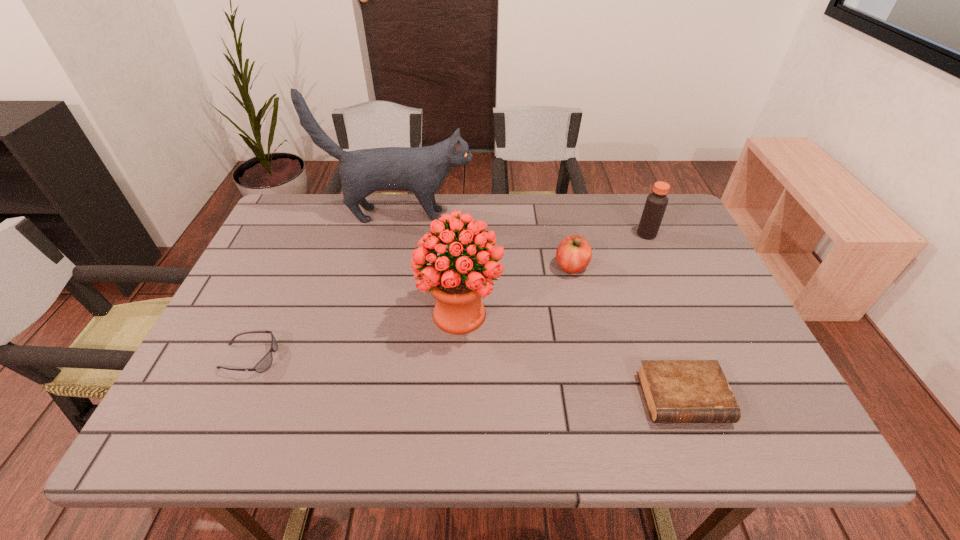
What are the coordinates of `diary present at the right edge` in the screenshot? It's located at (676, 391).

You are a GUI agent. You are given a task and a screenshot of the screen. Output one action in this format:
    pyautogui.click(x=<x>, y=<y>)
    Task: Click on the object situated at the far left corner
    The height and width of the screenshot is (540, 960).
    Given the screenshot: What is the action you would take?
    pyautogui.click(x=422, y=170)

Locate an element on the screen. The height and width of the screenshot is (540, 960). object that is at the far right corner is located at coordinates (656, 202).

Locate an element on the screen. object located at the near right corner is located at coordinates (676, 391).

At what (x,y) coordinates should I click in order to perform the action: click on vacant area at the far edge of the desktop. Please return your answer as a coordinate pair (x, y). The width and height of the screenshot is (960, 540). Looking at the image, I should click on (628, 237).

Image resolution: width=960 pixels, height=540 pixels. What are the coordinates of `vacant space at the near edge of the desktop` in the screenshot? It's located at (324, 423).

The width and height of the screenshot is (960, 540). I want to click on vacant space at the left edge of the desktop, so click(x=271, y=285).

Find the location of `free space at the right edge of the desktop`. free space at the right edge of the desktop is located at coordinates (665, 278).

This screenshot has width=960, height=540. Identify the location of vacant space at the far left corner of the desktop. click(x=313, y=216).

The width and height of the screenshot is (960, 540). I want to click on vacant area at the near left corner of the desktop, so click(177, 435).